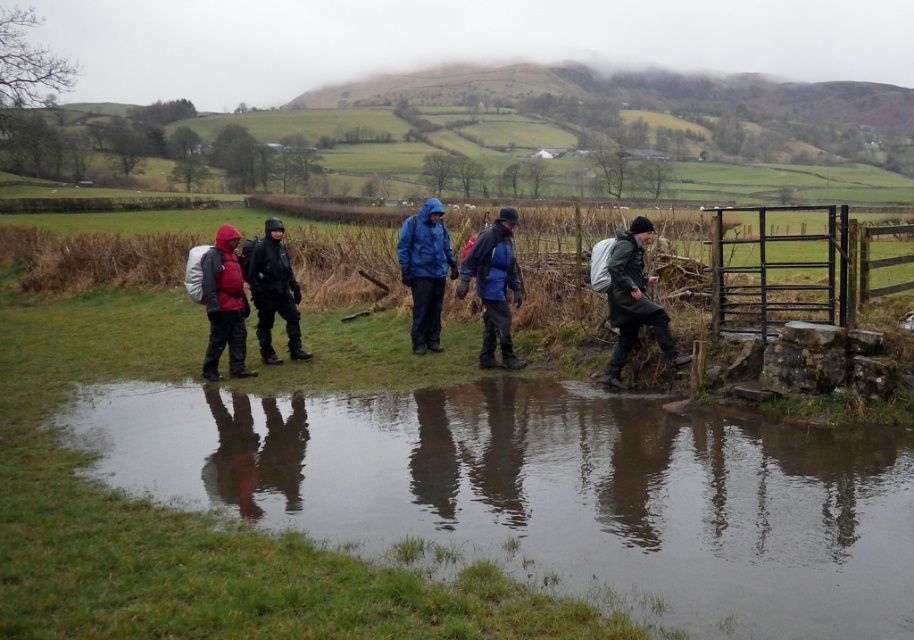
Question: Can you confirm if clear water at lower center is positioned above matte red jacket at left?

Choices:
 (A) no
 (B) yes

Answer: (A)

Question: Which object is the farthest from the clear water at lower center?

Choices:
 (A) matte red jacket at left
 (B) blue matte jacket at center
 (C) matte blue jacket at center

Answer: (C)

Question: Which point is farther to the camera?

Choices:
 (A) matte black jacket at center
 (B) matte blue jacket at center

Answer: (B)

Question: Is blue matte jacket at center above matte black jacket at center?

Choices:
 (A) no
 (B) yes

Answer: (A)

Question: Does dark green waterproof jacket at right have a larger size compared to matte blue jacket at center?

Choices:
 (A) yes
 (B) no

Answer: (A)

Question: Which object appears closest to the camera in this image?

Choices:
 (A) dark green waterproof jacket at right
 (B) blue matte jacket at center
 (C) matte black jacket at center

Answer: (A)